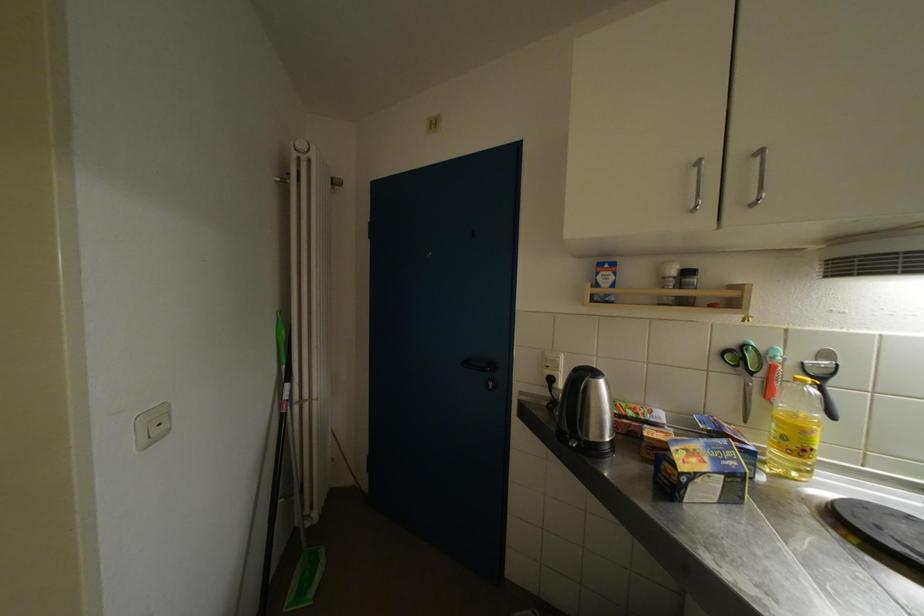
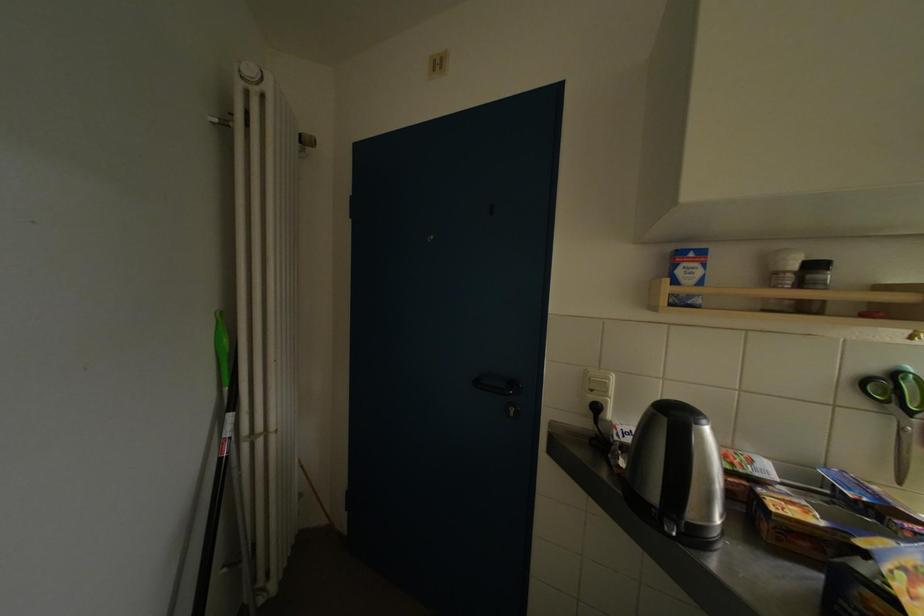
In the second image, find the point that corresponds to the point at 309,148 in the first image.

(256, 75)